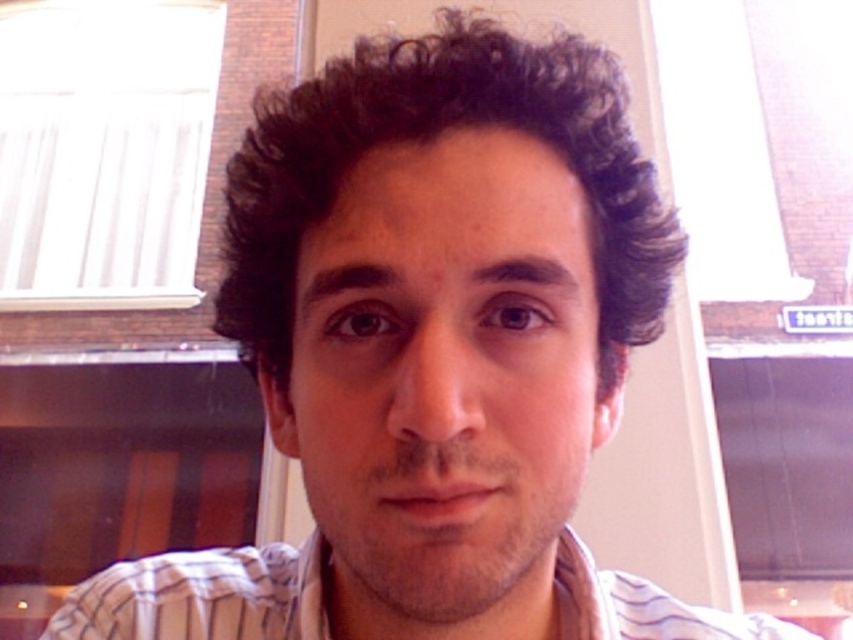
Can you confirm if dark curly hair at center is positioned below white striped shirt at center?

Actually, dark curly hair at center is above white striped shirt at center.

Image resolution: width=853 pixels, height=640 pixels. What do you see at coordinates (428, 140) in the screenshot?
I see `dark curly hair at center` at bounding box center [428, 140].

Where is `dark curly hair at center`? dark curly hair at center is located at coordinates (428, 140).